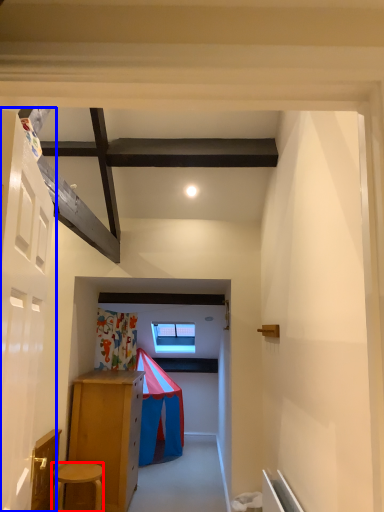
Question: Which object appears farthest to the camera in this image, stool (highlighted by a red box) or door (highlighted by a blue box)?

Choices:
 (A) stool
 (B) door

Answer: (A)